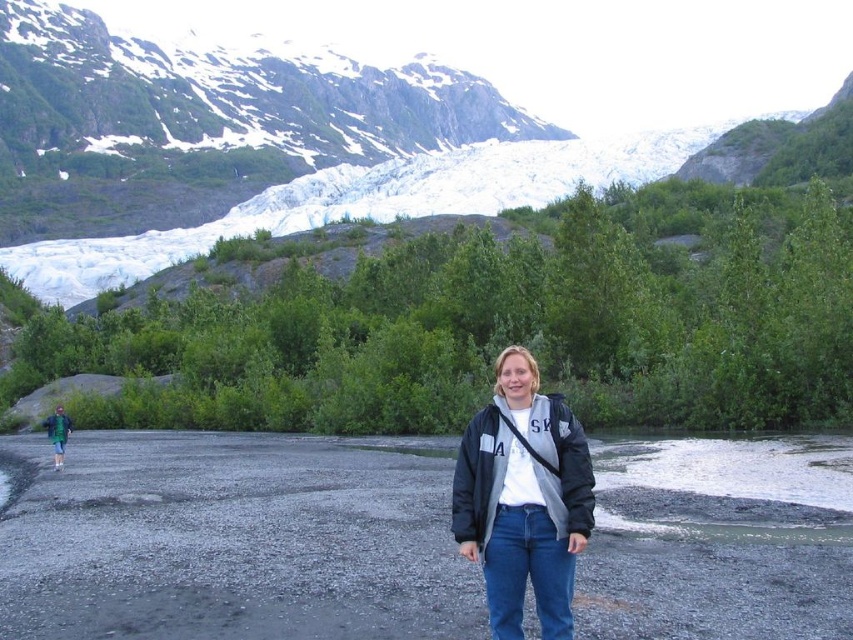
From the picture: Is white snow-covered mountain at upper center shorter than matte gray jacket at center?

No.

Who is higher up, white snow-covered mountain at upper center or matte gray jacket at center?

white snow-covered mountain at upper center is higher up.

This screenshot has width=853, height=640. I want to click on white snow-covered mountain at upper center, so click(498, 90).

Does point (581, 497) come farther from viewer compared to point (61, 452)?

No, (581, 497) is in front of (61, 452).

Can you confirm if matte gray jacket at center is positioned below green fabric jacket at lower left?

Actually, matte gray jacket at center is above green fabric jacket at lower left.

What do you see at coordinates (523, 499) in the screenshot? I see `matte gray jacket at center` at bounding box center [523, 499].

Where is `matte gray jacket at center`? The image size is (853, 640). matte gray jacket at center is located at coordinates (523, 499).

Which is more to the right, white snow-covered mountain at upper center or green fabric jacket at lower left?

white snow-covered mountain at upper center is more to the right.

Can you confirm if white snow-covered mountain at upper center is smaller than green fabric jacket at lower left?

No, white snow-covered mountain at upper center is not smaller than green fabric jacket at lower left.

Locate an element on the screen. The width and height of the screenshot is (853, 640). white snow-covered mountain at upper center is located at coordinates (498, 90).

Identify the location of white snow-covered mountain at upper center. (498, 90).